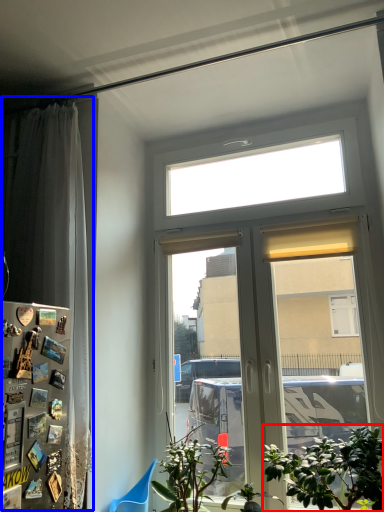
Question: Which point is further to the camera, houseplant (highlighted by a red box) or curtain (highlighted by a blue box)?

Choices:
 (A) houseplant
 (B) curtain

Answer: (B)